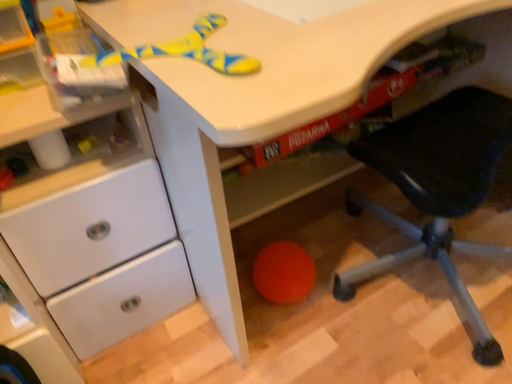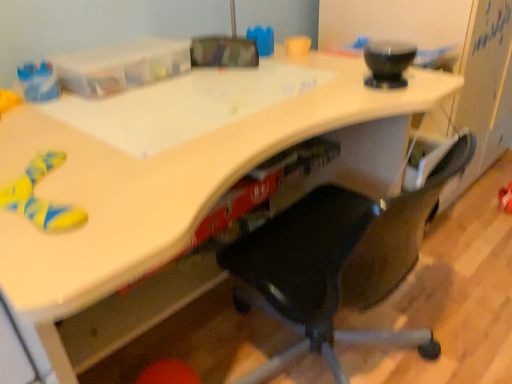
Question: Which way did the camera rotate in the video?

Choices:
 (A) rotated upward
 (B) rotated downward

Answer: (A)